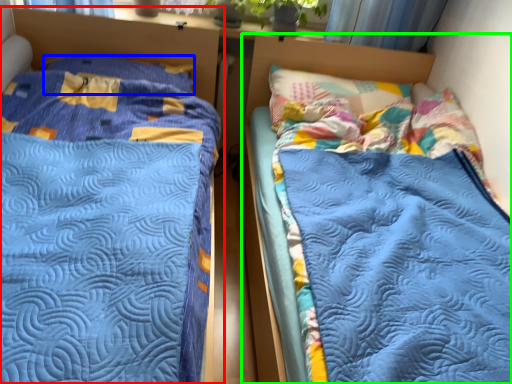
Question: Estimate the real-world distances between objects in this image. Which object is farther from bed (highlighted by a red box), pillow (highlighted by a blue box) or bed (highlighted by a green box)?

Choices:
 (A) pillow
 (B) bed

Answer: (B)